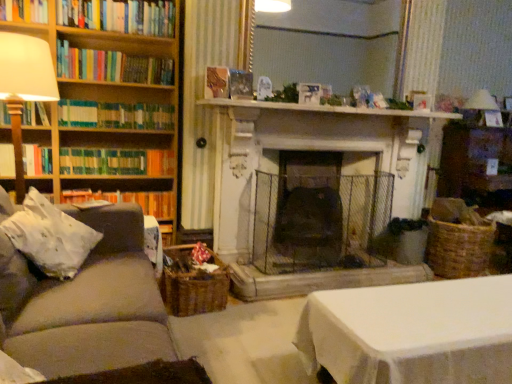
Question: Does hardcover books at left, which is counted as the 6th book, starting from the bottom, touch green matte bookshelf at left, arranged as the 3th book when ordered from the bottom?

Choices:
 (A) no
 (B) yes

Answer: (A)

Question: Is the position of hardcover books at left, which is counted as the 6th book, starting from the bottom, more distant than that of green matte bookshelf at left, which is counted as the sixth book, starting from the top?

Choices:
 (A) no
 (B) yes

Answer: (A)

Question: Can you confirm if hardcover books at left, which is counted as the 6th book, starting from the bottom, is wider than green matte bookshelf at left, which is counted as the sixth book, starting from the top?

Choices:
 (A) yes
 (B) no

Answer: (B)

Question: Considering the relative sizes of hardcover books at left, which is counted as the 6th book, starting from the bottom, and green matte bookshelf at left, arranged as the 3th book when ordered from the bottom, in the image provided, is hardcover books at left, which is counted as the 6th book, starting from the bottom, smaller than green matte bookshelf at left, arranged as the 3th book when ordered from the bottom,?

Choices:
 (A) yes
 (B) no

Answer: (B)

Question: Is hardcover books at left, which is the third book from top to bottom, closer to camera compared to green matte bookshelf at left, which is counted as the sixth book, starting from the top?

Choices:
 (A) no
 (B) yes

Answer: (B)

Question: From the image's perspective, is hardcover books at left, which is counted as the 6th book, starting from the bottom, under green matte bookshelf at left, arranged as the 3th book when ordered from the bottom?

Choices:
 (A) yes
 (B) no

Answer: (B)

Question: From a real-world perspective, is hardcover books at left, which is the third book from top to bottom, under matte white table lamp at upper right, marked as the first table lamp in a back-to-front arrangement?

Choices:
 (A) no
 (B) yes

Answer: (A)

Question: Does hardcover books at left, which is counted as the 6th book, starting from the bottom, have a lesser height compared to matte white table lamp at upper right, which is the 2th table lamp from front to back?

Choices:
 (A) yes
 (B) no

Answer: (A)

Question: Is hardcover books at left, which is the third book from top to bottom, bigger than matte white table lamp at upper right, which appears as the second table lamp when viewed from the left?

Choices:
 (A) yes
 (B) no

Answer: (B)

Question: From the image's perspective, would you say hardcover books at left, which is the third book from top to bottom, is shown under matte white table lamp at upper right, marked as the first table lamp in a back-to-front arrangement?

Choices:
 (A) no
 (B) yes

Answer: (A)

Question: Is hardcover books at left, which is the third book from top to bottom, not inside matte white table lamp at upper right, which appears as the second table lamp when viewed from the left?

Choices:
 (A) yes
 (B) no

Answer: (A)

Question: Is hardcover books at left, which is the third book from top to bottom, behind matte white table lamp at upper right, which appears as the second table lamp when viewed from the left?

Choices:
 (A) no
 (B) yes

Answer: (A)

Question: From the image's perspective, is wooden bookshelf at left located above woven brown basket at lower center?

Choices:
 (A) no
 (B) yes

Answer: (B)